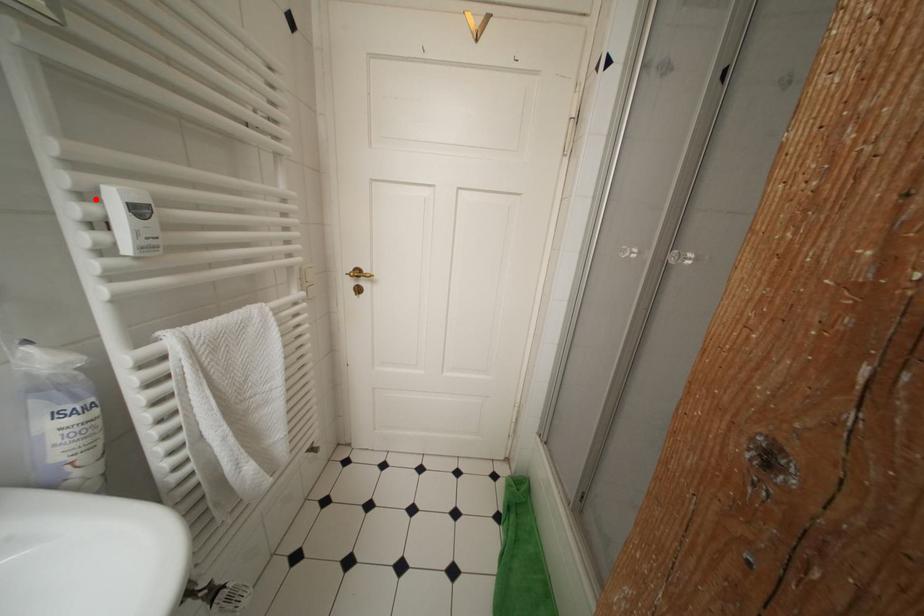
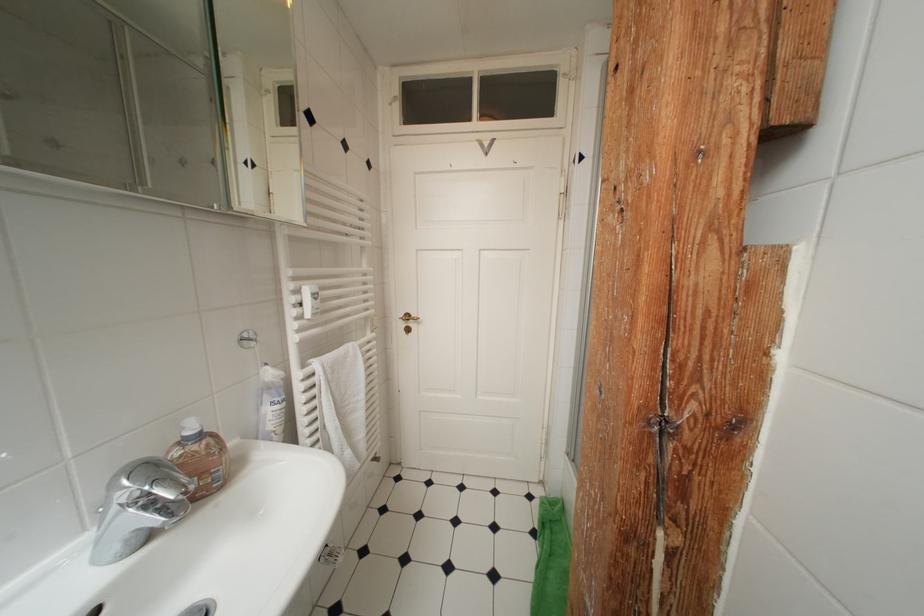
Find the pixel in the second image that matches the highlighted location in the first image.

(304, 294)